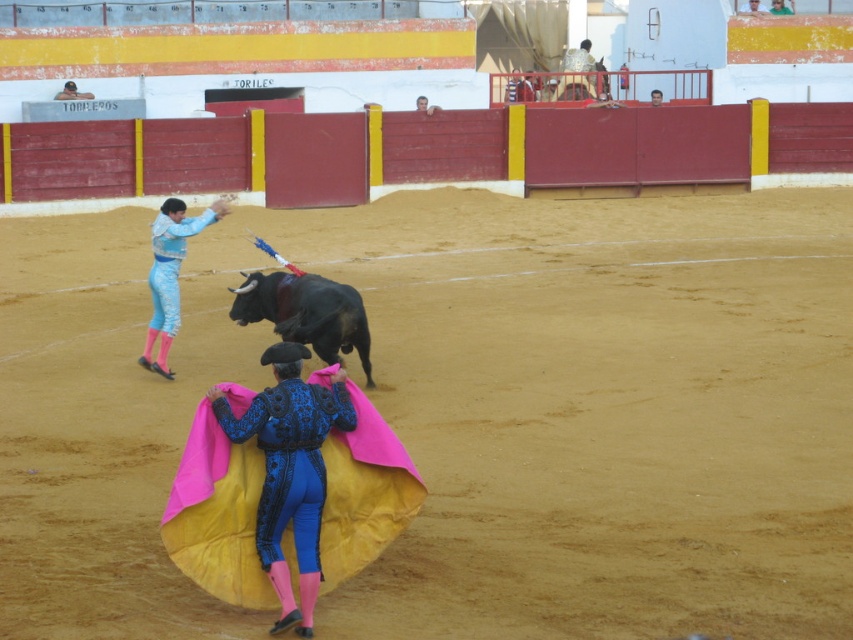
You are a safety officer assessing the bullfighting arena. You need to ensure that the light blue satin suit at left is positioned at least 10 meters away from the camera to maintain safety. Based on the scene description, is the current distance compliant with the safety requirement?

The light blue satin suit at left is 12.68 meters away from the camera, which exceeds the minimum required distance of 10 meters. Therefore, the current positioning complies with the safety requirement.

You are a photographer positioned at point (170, 275) in the arena. You want to capture the matador in action. Which object is located at your current position?

The point at (170, 275) indicates the light blue satin suit at left, so the light blue satin suit at left is located at your current position.